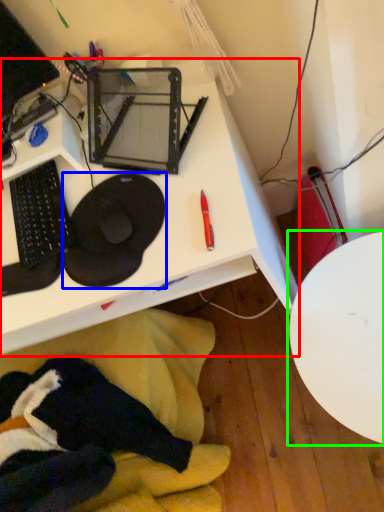
Question: Which object is positioned farthest from desk (highlighted by a red box)? Select from sit (highlighted by a blue box) and table (highlighted by a green box).

Choices:
 (A) sit
 (B) table

Answer: (B)